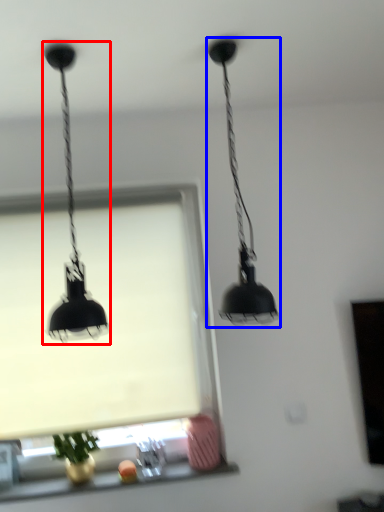
Question: Which of the following is the closest to the observer, lamp (highlighted by a red box) or lamp (highlighted by a blue box)?

Choices:
 (A) lamp
 (B) lamp

Answer: (A)